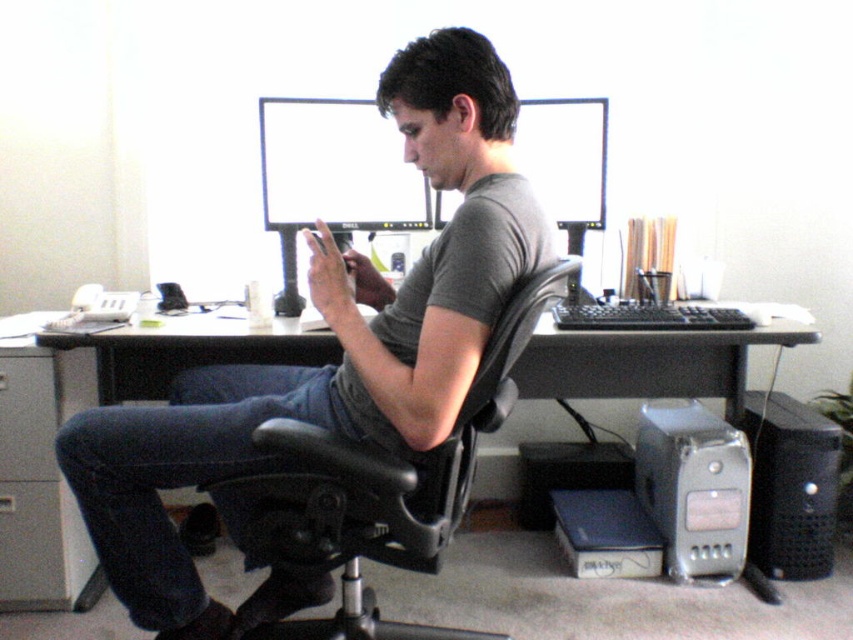
Does gray matte shirt at center lie behind matte black monitor at center?

No, gray matte shirt at center is in front of matte black monitor at center.

Can you confirm if gray matte shirt at center is thinner than matte black monitor at center?

In fact, gray matte shirt at center might be wider than matte black monitor at center.

Find the location of a particular element. This screenshot has width=853, height=640. gray matte shirt at center is located at coordinates (341, 346).

Who is taller, matte black monitor at center or silver metallic computer at lower right?

silver metallic computer at lower right

Where is `matte black monitor at center`? This screenshot has height=640, width=853. matte black monitor at center is located at coordinates (335, 168).

Is gray matte shirt at center shorter than silver metallic computer at lower right?

Incorrect, gray matte shirt at center's height does not fall short of silver metallic computer at lower right's.

Is gray matte shirt at center smaller than silver metallic computer at lower right?

No, gray matte shirt at center is not smaller than silver metallic computer at lower right.

Does point (529, 214) come behind point (689, 412)?

That is False.

The image size is (853, 640). What are the coordinates of `gray matte shirt at center` in the screenshot? It's located at (341, 346).